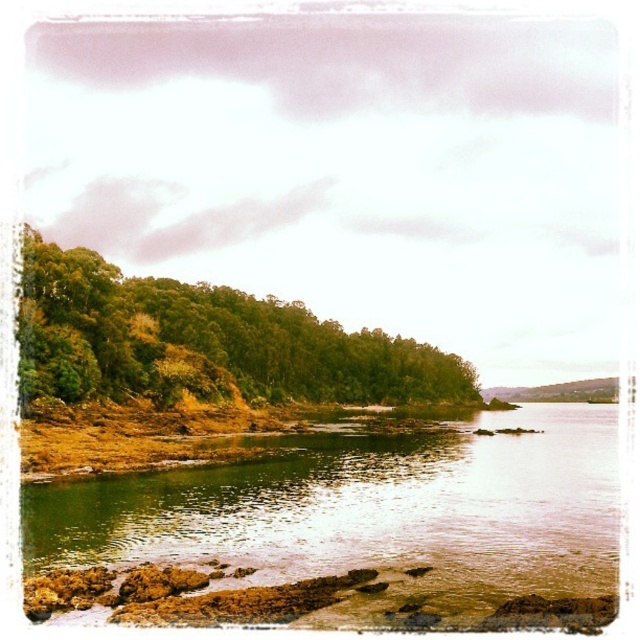
Looking at this image, you are a hiker who has just arrived at the coast and wants to walk from the green mossy rocks at lower left to the green leafy trees at left. Given that your average walking pace is 3 feet per second, how many seconds will it take you to reach the trees?

The distance between the green mossy rocks at lower left and the green leafy trees at left is 185.72 feet. At a pace of 3 feet per second, dividing the distance by the speed gives 185.72 divided by 3, which equals approximately 61.9 seconds. Therefore, it will take roughly 62 seconds to reach the trees.

You are standing at the shoreline looking towards the trees. There are two points marked in the image. The first point is at coordinates point (x=531, y=472) and the second point is at point (x=442, y=356). Which point is closer to you?

Point (x=531, y=472) is in front of point (x=442, y=356), so the first point is closer to you.